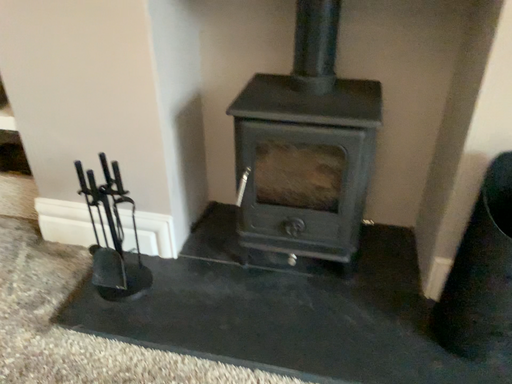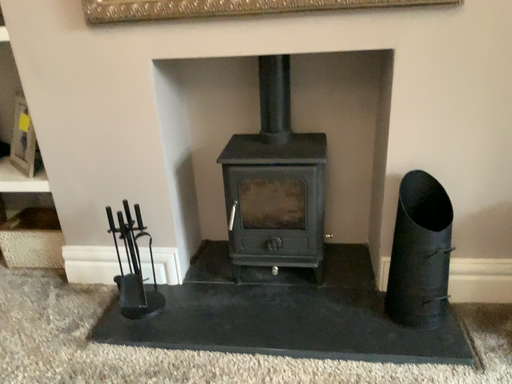
Question: How did the camera likely rotate when shooting the video?

Choices:
 (A) rotated downward
 (B) rotated upward

Answer: (B)